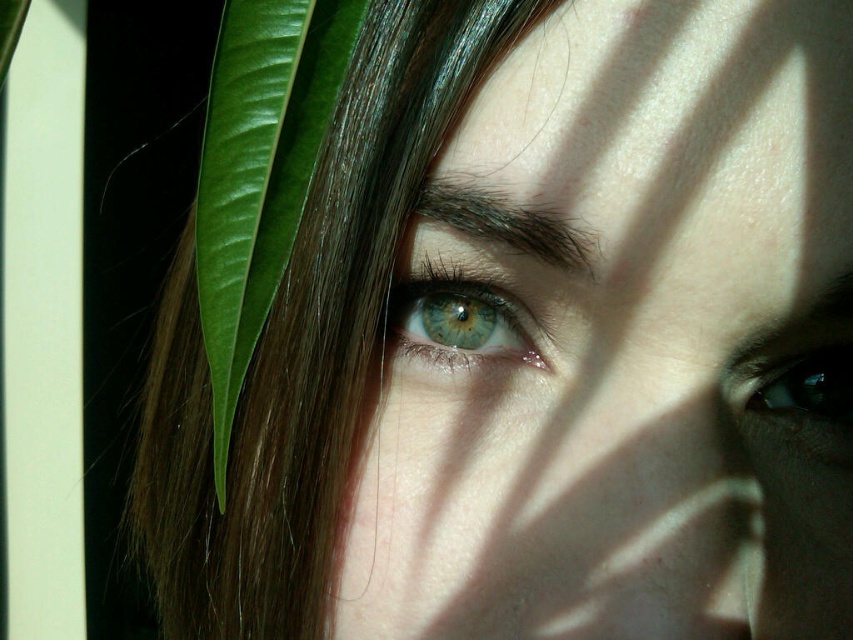
You are an artist trying to paint the scene. You need to decide the order to paint the objects so that the one covering the other is painted last. Which object should you paint first, the green glossy leaf at left or the green matte eye at right?

The green glossy leaf at left should be painted first because it is located above the green matte eye at right, meaning it partially obscures it. By painting the leaf first, you can then paint the eye over it to achieve the correct layering.

You are a photographer trying to capture the eye in the image. Since the green glossy leaf at left and the green matte eye at center are both green, could the leaf be blocking the eye from view?

The green glossy leaf at left is in front of the green matte eye at center, so yes, the leaf is blocking the eye from view.

You are a photographer adjusting the focus on a camera lens. The subject has two green matte eyes visible in the frame. If you want to ensure both green matte eye at center and green matte eye at right are in focus simultaneously, what is the minimum depth of field required?

The minimum depth of field required is at least 3.51 inches to cover the distance between the green matte eye at center and green matte eye at right.